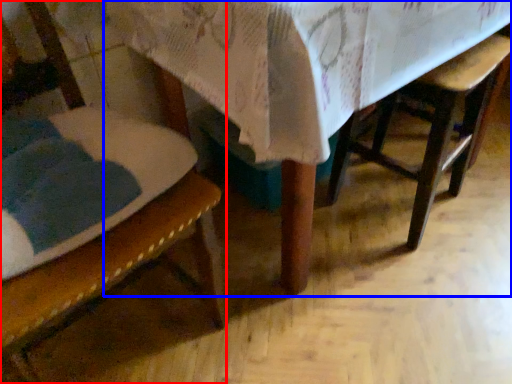
Question: Among these objects, which one is farthest to the camera, chair (highlighted by a red box) or table (highlighted by a blue box)?

Choices:
 (A) chair
 (B) table

Answer: (B)